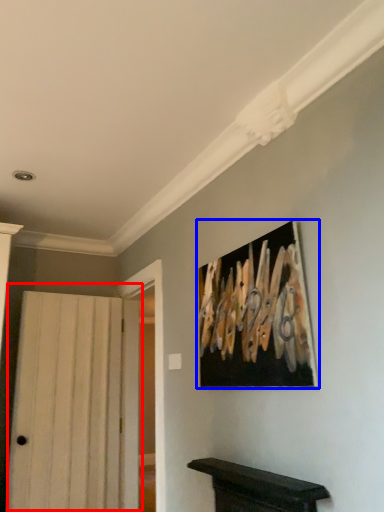
Question: Which object appears farthest to the camera in this image, door (highlighted by a red box) or picture frame (highlighted by a blue box)?

Choices:
 (A) door
 (B) picture frame

Answer: (A)